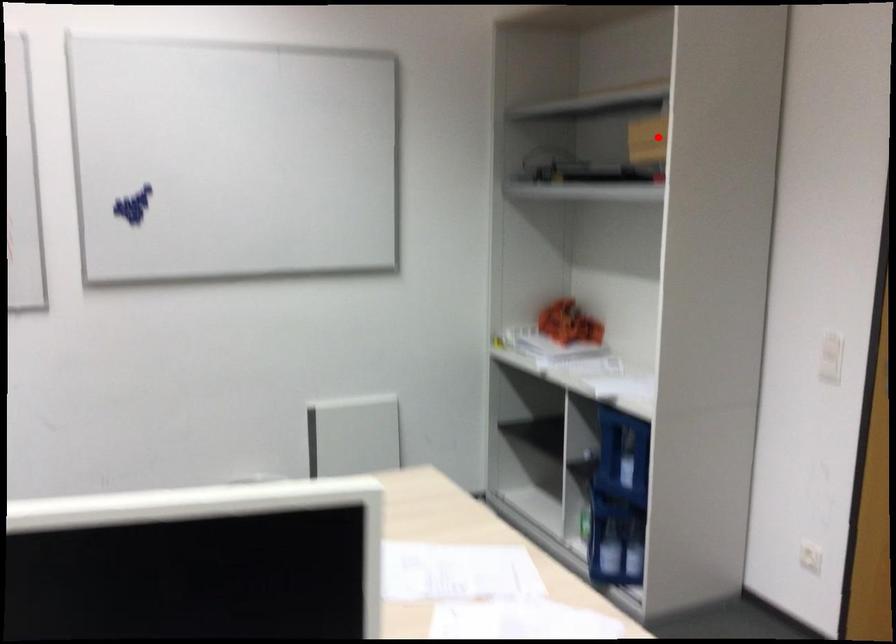
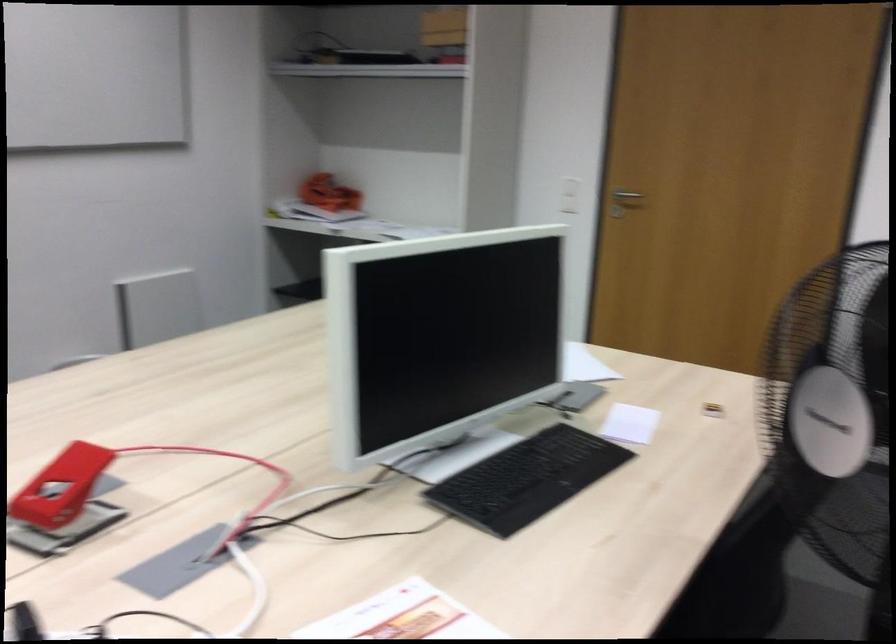
Question: I am providing you with two images of the same scene from different viewpoints. Image1 has a red point marked. In image2, the corresponding 3D location appears at what relative position? Reply with the corresponding letter.

Choices:
 (A) Closer
 (B) Farther

Answer: (B)